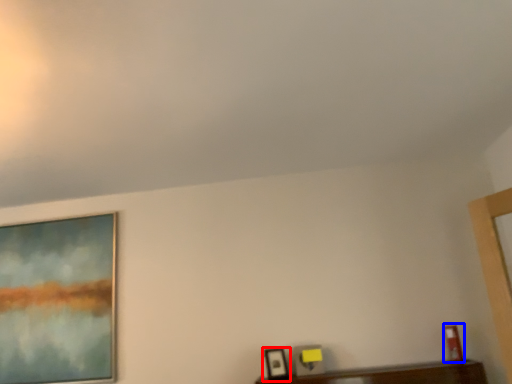
Question: Which object appears closest to the camera in this image, picture frame (highlighted by a red box) or picture frame (highlighted by a blue box)?

Choices:
 (A) picture frame
 (B) picture frame

Answer: (B)